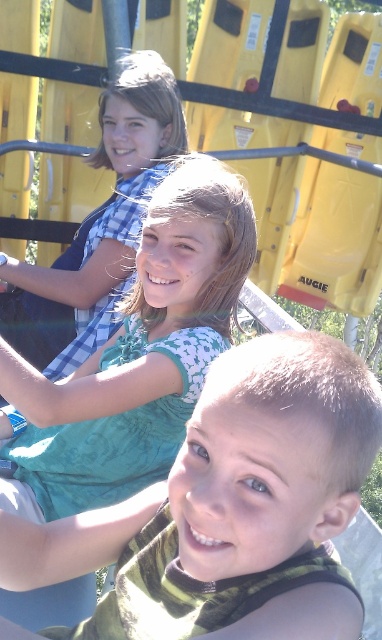
You are a photographer trying to capture a candid shot of the children. You notice two green fabric shirts in the scene. Which one is closer to the camera, the green fabric shirt at center or the green fabric shirt at upper center?

The green fabric shirt at center is shorter than the green fabric shirt at upper center, so the green fabric shirt at center is closer to the camera.